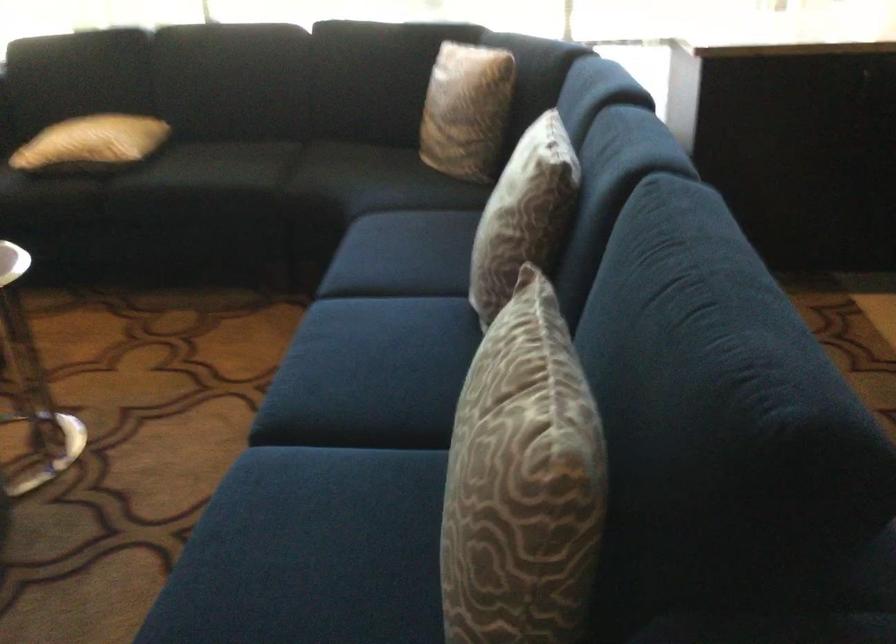
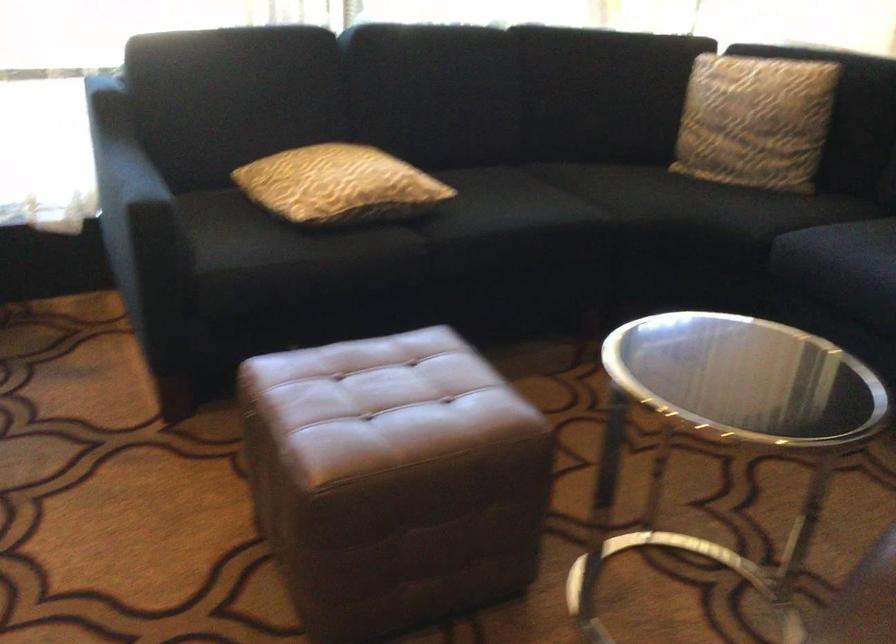
Where in the second image is the point corresponding to point 125,178 from the first image?

(426, 227)